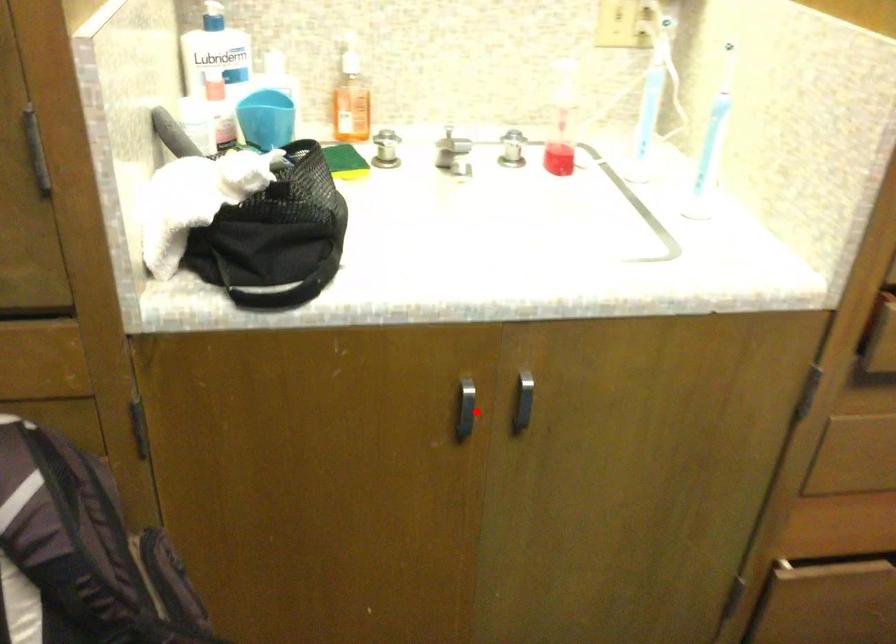
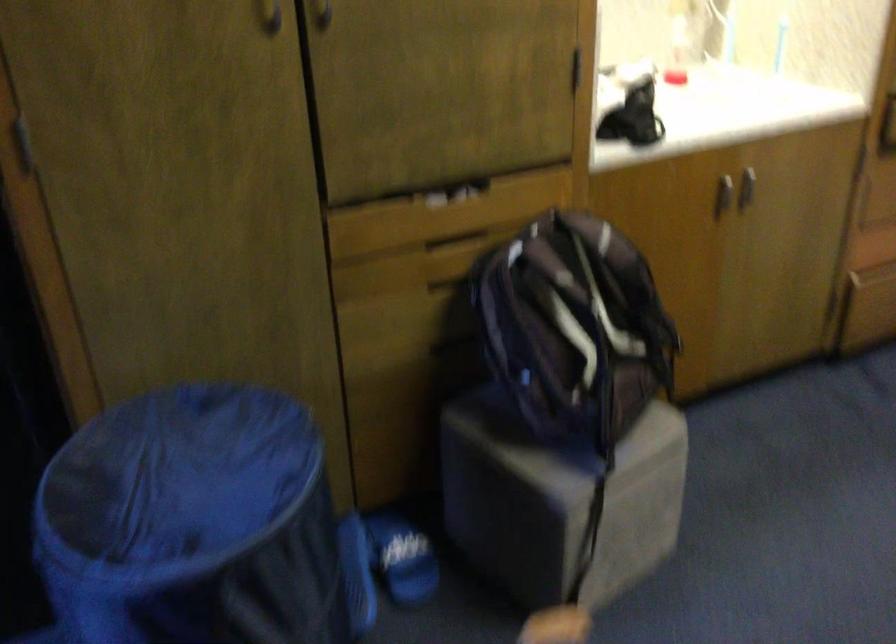
Question: I am providing you with two images of the same scene from different viewpoints. Image1 has a red point marked. In image2, the corresponding 3D location appears at what relative position? Reply with the corresponding letter.

Choices:
 (A) Closer
 (B) Farther

Answer: (B)